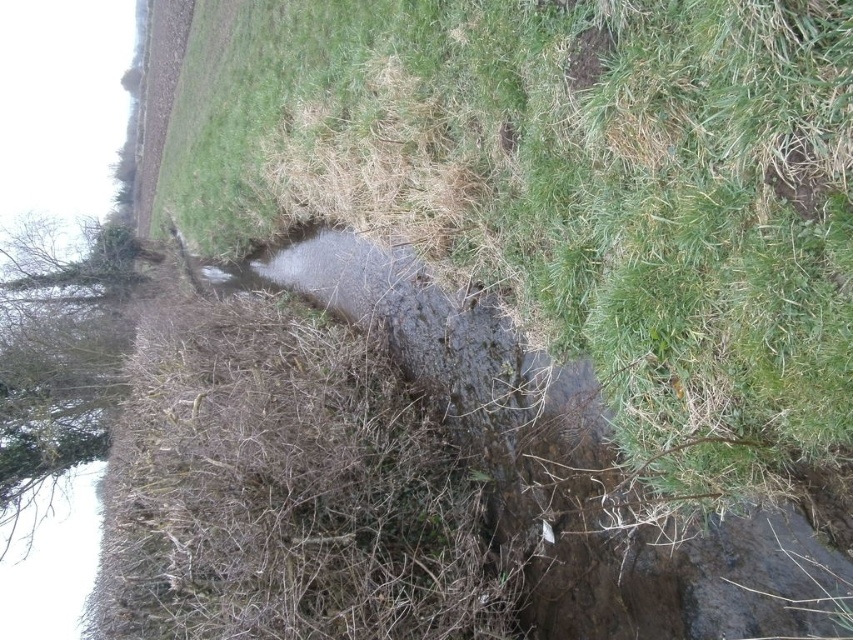
Can you confirm if green grassy at center is taller than green leafy tree at left?

Incorrect, green grassy at center's height is not larger of green leafy tree at left's.

You are a GUI agent. You are given a task and a screenshot of the screen. Output one action in this format:
    pyautogui.click(x=<x>, y=<y>)
    Task: Click on the green grassy at center
    
    Given the screenshot: What is the action you would take?
    pyautogui.click(x=569, y=192)